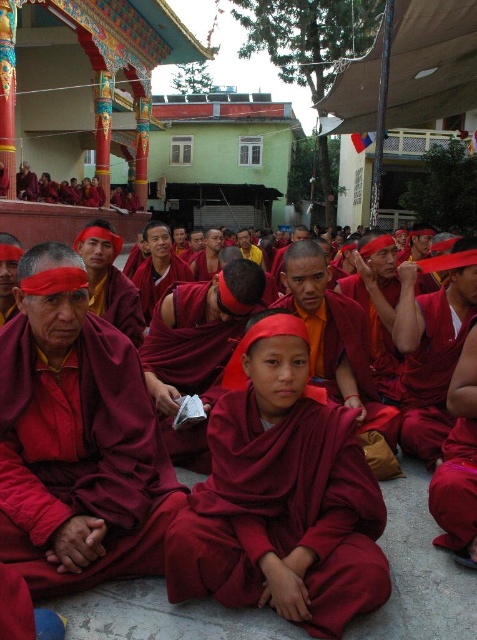
Can you confirm if matte maroon robe at center is positioned to the right of matte red robe at center?

Indeed, matte maroon robe at center is positioned on the right side of matte red robe at center.

Where is `matte maroon robe at center`? The image size is (477, 640). matte maroon robe at center is located at coordinates (76, 440).

Does maroon cotton robe at center have a larger size compared to matte red robe at center?

No, maroon cotton robe at center is not bigger than matte red robe at center.

Does maroon cotton robe at center lie behind matte red robe at center?

Yes, it is.

The width and height of the screenshot is (477, 640). I want to click on maroon cotton robe at center, so click(282, 513).

Between matte maroon robe at center and maroon cotton robe at center, which one has more height?

Standing taller between the two is matte maroon robe at center.

Does matte maroon robe at center lie behind maroon cotton robe at center?

No, matte maroon robe at center is in front of maroon cotton robe at center.

Is point (103, 440) closer to viewer compared to point (309, 577)?

No.

Locate an element on the screen. The width and height of the screenshot is (477, 640). matte maroon robe at center is located at coordinates (76, 440).